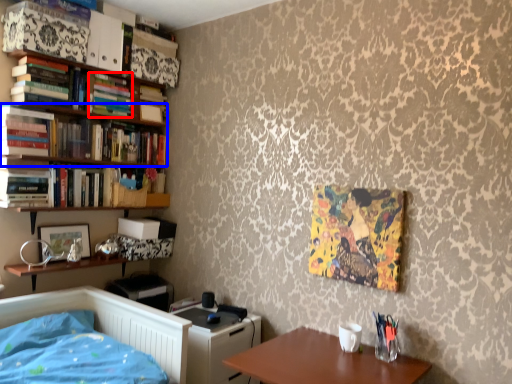
Question: Which object is closer to the camera taking this photo, book (highlighted by a red box) or book (highlighted by a blue box)?

Choices:
 (A) book
 (B) book

Answer: (B)